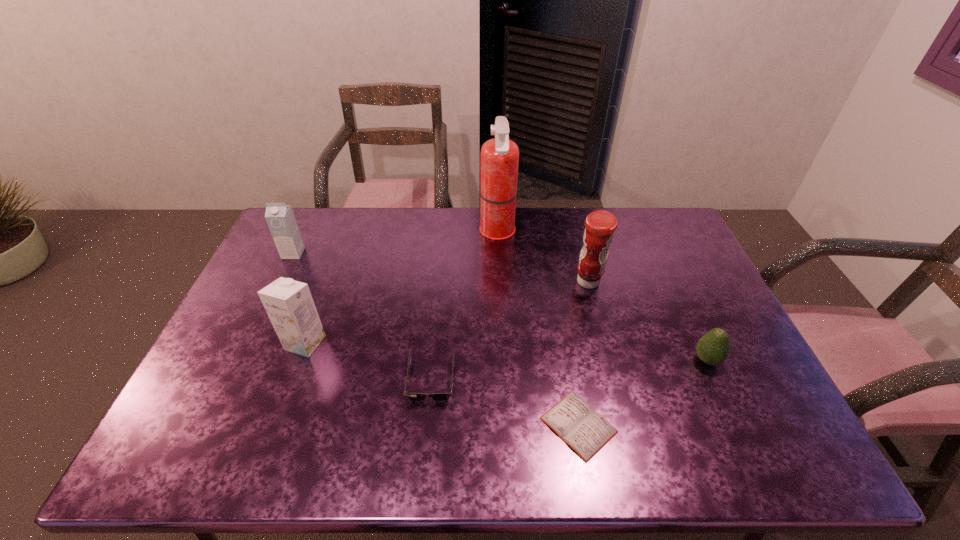
I want to click on the sixth tallest object, so click(x=415, y=397).

The width and height of the screenshot is (960, 540). Find the location of `the shortest object`. the shortest object is located at coordinates pyautogui.click(x=586, y=431).

At what (x,y) coordinates should I click in order to perform the action: click on vacant space located 0.270m with the handle and hose on the fire extinguisher. Please return your answer as a coordinate pair (x, y). Looking at the image, I should click on (405, 232).

Where is `free spot located with the handle and hose on the fire extinguisher`? Image resolution: width=960 pixels, height=540 pixels. free spot located with the handle and hose on the fire extinguisher is located at coordinates (444, 232).

Locate an element on the screen. The image size is (960, 540). free space located 0.260m with the handle and hose on the fire extinguisher is located at coordinates (408, 232).

Where is `free space located 0.280m on the front of the condiment`? free space located 0.280m on the front of the condiment is located at coordinates (612, 370).

Where is `vacant region located 0.090m on the right of the nearer carton`? The image size is (960, 540). vacant region located 0.090m on the right of the nearer carton is located at coordinates pos(356,343).

At what (x,y) coordinates should I click in order to perform the action: click on vacant space located on the front label of the farther carton. Please return your answer as a coordinate pair (x, y). Looking at the image, I should click on (285, 271).

Locate an element on the screen. The height and width of the screenshot is (540, 960). vacant point located 0.170m on the back of the third shortest object is located at coordinates (681, 304).

I want to click on blank space located on the temples of the sunglasses, so click(x=424, y=451).